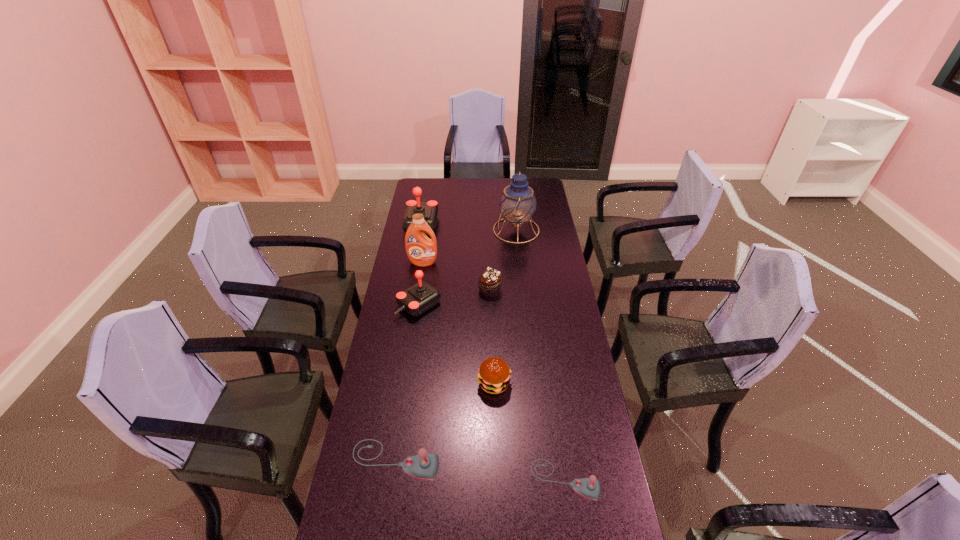
Locate an element on the screen. This screenshot has width=960, height=540. vacant area located on the front of the third nearest joystick is located at coordinates (416, 329).

In order to click on vacant space located on the back of the brown cupcake in this screenshot , I will do [489, 246].

You are a GUI agent. You are given a task and a screenshot of the screen. Output one action in this format:
    pyautogui.click(x=<x>, y=<y>)
    Task: Click on the free space located 0.080m on the back of the hamburger
    The width and height of the screenshot is (960, 540).
    Given the screenshot: What is the action you would take?
    pyautogui.click(x=493, y=353)

The height and width of the screenshot is (540, 960). I want to click on vacant space located on the front of the second shortest joystick, so click(388, 511).

Where is `vacant space located 0.070m on the front of the rightmost joystick`? The width and height of the screenshot is (960, 540). vacant space located 0.070m on the front of the rightmost joystick is located at coordinates (572, 529).

The image size is (960, 540). Identify the location of detergent located in the left edge section of the desktop. (421, 251).

Locate an element on the screen. This screenshot has height=540, width=960. lantern located at the right edge is located at coordinates (518, 203).

Locate an element on the screen. The width and height of the screenshot is (960, 540). joystick located at the right edge is located at coordinates (590, 488).

Where is `vacant space at the left edge of the desktop`? The width and height of the screenshot is (960, 540). vacant space at the left edge of the desktop is located at coordinates (370, 443).

The width and height of the screenshot is (960, 540). Identify the location of vacant space at the right edge of the desktop. (530, 248).